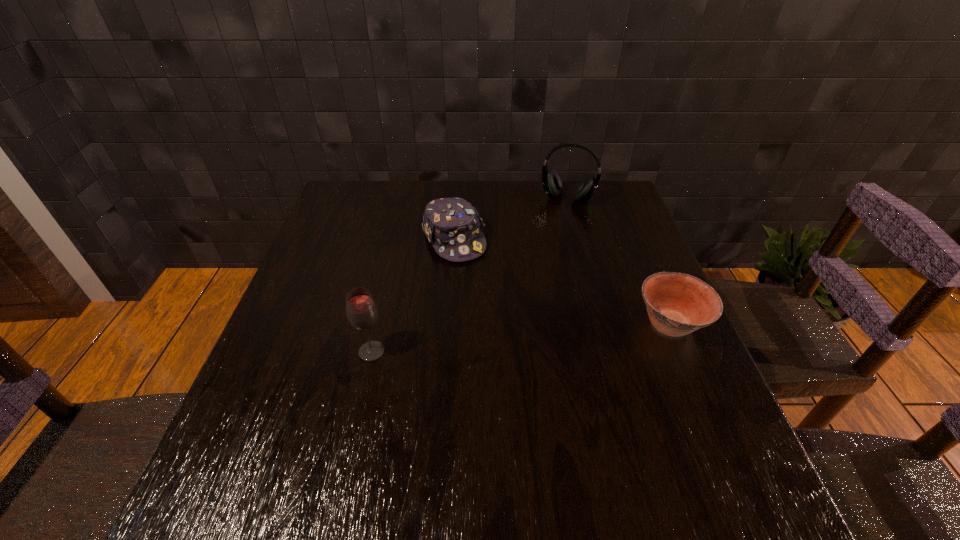
Locate an element on the screen. vacant region located on the front-facing side of the headwear is located at coordinates (496, 313).

Locate an element on the screen. The height and width of the screenshot is (540, 960). vacant area situated on the front-facing side of the headwear is located at coordinates (503, 325).

Identify the location of vacant space located 0.380m on the front-facing side of the headwear. (532, 372).

I want to click on headset positioned at the far edge, so click(x=551, y=181).

Where is `headwear that is at the far edge`? headwear that is at the far edge is located at coordinates (452, 225).

Where is `bowl present at the right edge`? bowl present at the right edge is located at coordinates (677, 304).

Image resolution: width=960 pixels, height=540 pixels. In order to click on headset at the right edge in this screenshot , I will do `click(551, 181)`.

Identify the location of object located at the far right corner. (551, 181).

Find the location of a particular element. This screenshot has width=960, height=540. free space at the far edge of the desktop is located at coordinates (561, 209).

Where is `vacant region at the near edge of the desktop`? The height and width of the screenshot is (540, 960). vacant region at the near edge of the desktop is located at coordinates (566, 416).